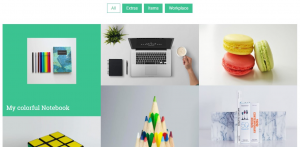
The height and width of the screenshot is (147, 300). I want to click on laptop, so click(x=161, y=66).